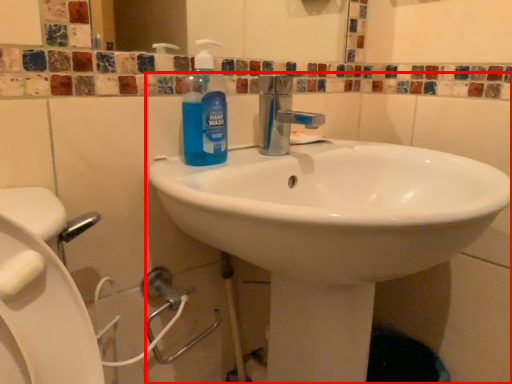
Question: In this image, where is sink (annotated by the red box) located relative to cleaning product?

Choices:
 (A) right
 (B) left

Answer: (A)